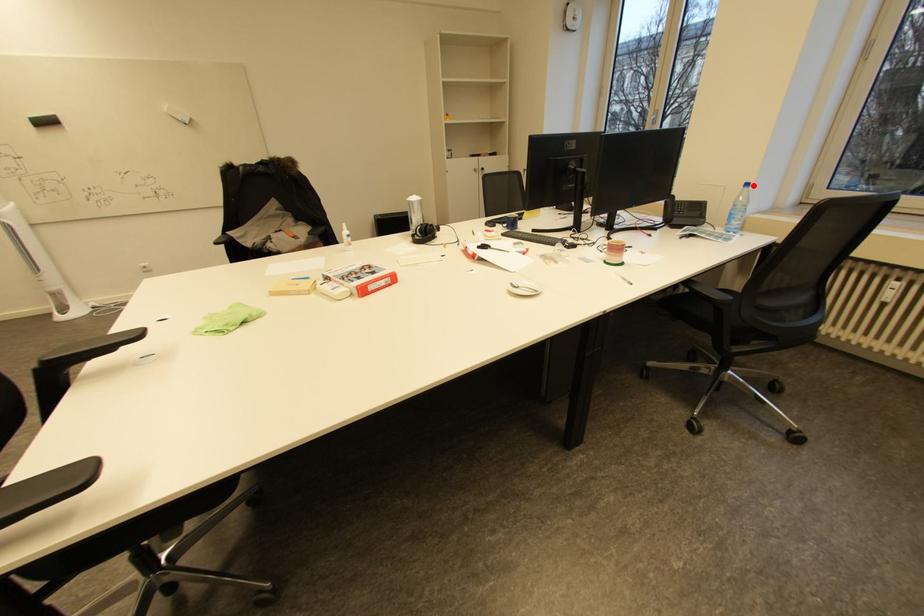
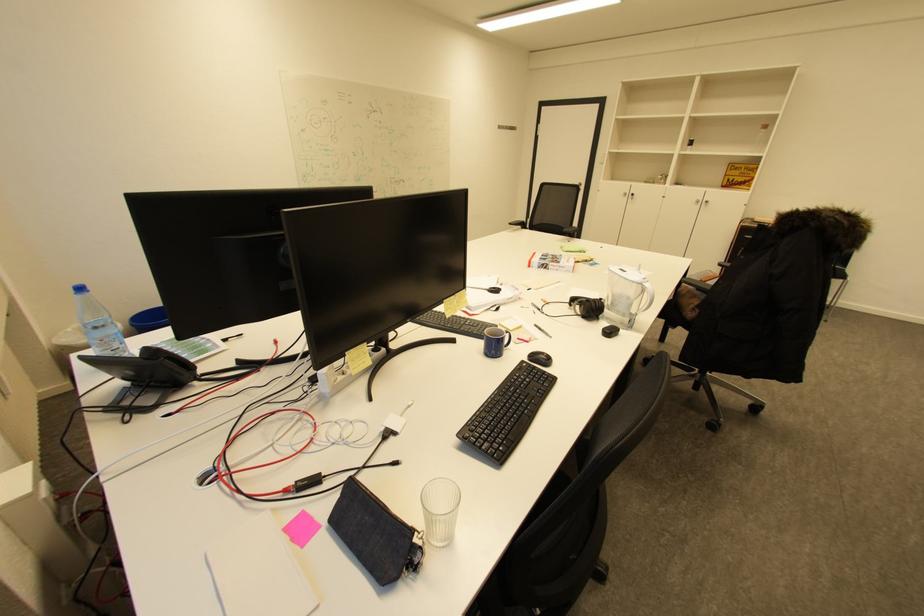
Question: I am providing you with two images of the same scene from different viewpoints. Given a red point in image1, look at the same physical point in image2. Is it:

Choices:
 (A) Closer to the viewpoint
 (B) Farther from the viewpoint

Answer: (A)